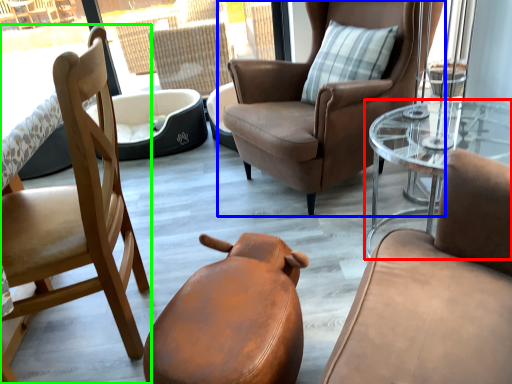
Question: Which object is the closest to the coffee table (highlighted by a red box)? Choose among these: chair (highlighted by a blue box) or chair (highlighted by a green box).

Choices:
 (A) chair
 (B) chair

Answer: (A)